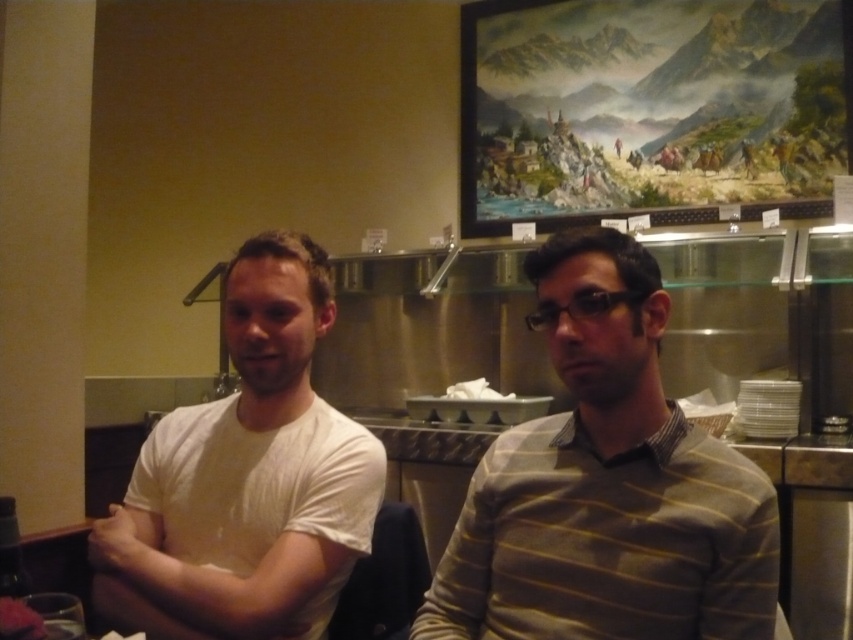
Question: Which point is closer to the camera?

Choices:
 (A) (463, 634)
 (B) (305, 387)

Answer: (A)

Question: Which point is closer to the camera?

Choices:
 (A) striped sweater at center
 (B) white cotton t-shirt at left

Answer: (A)

Question: Is striped sweater at center bigger than white cotton t-shirt at left?

Choices:
 (A) yes
 (B) no

Answer: (B)

Question: Is striped sweater at center to the left of white cotton t-shirt at left from the viewer's perspective?

Choices:
 (A) yes
 (B) no

Answer: (B)

Question: Is striped sweater at center smaller than white cotton t-shirt at left?

Choices:
 (A) no
 (B) yes

Answer: (B)

Question: Among these objects, which one is farthest from the camera?

Choices:
 (A) striped sweater at center
 (B) white cotton t-shirt at left

Answer: (B)